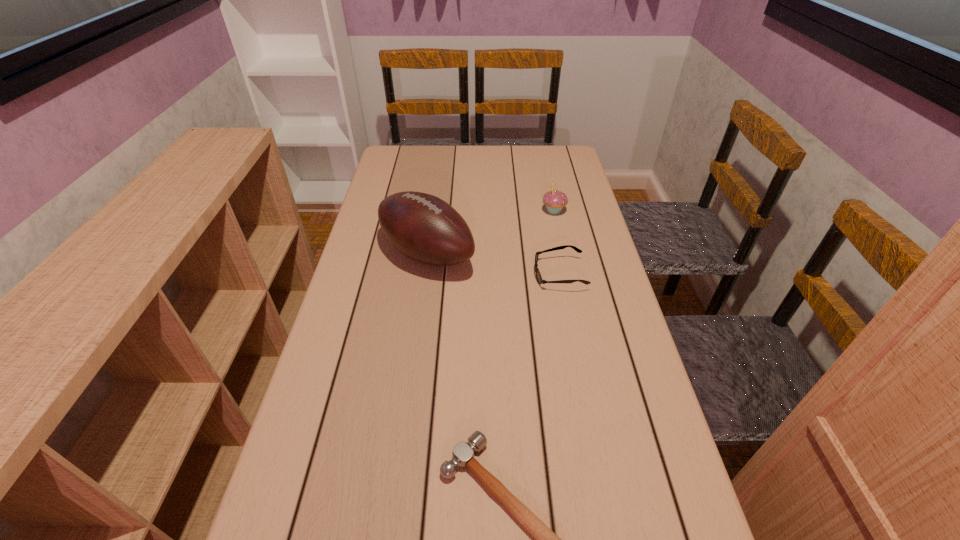
Identify the location of vacant region between the sunglasses and the football (American). (493, 264).

Identify the location of vacant space that is in between the third tallest object and the third shortest object. (557, 242).

Point out which object is positioned as the third nearest to the hammer. Please provide its 2D coordinates. Your answer should be formatted as a tuple, i.e. [(x, y)], where the tuple contains the x and y coordinates of a point satisfying the conditions above.

[(554, 200)]

Identify the location of object that is the closest to the sunglasses. (423, 227).

Find the location of a particular element. This screenshot has width=960, height=540. free space that satisfies the following two spatial constraints: 1. on the front side of the farthest object; 2. on the lenses of the second shortest object is located at coordinates (567, 274).

In order to click on free space in the image that satisfies the following two spatial constraints: 1. on the front side of the cupcake; 2. on the lenses of the sunglasses in this screenshot , I will do `click(567, 274)`.

Where is `free space that satisfies the following two spatial constraints: 1. on the front side of the third shortest object; 2. on the lenses of the third tallest object`? free space that satisfies the following two spatial constraints: 1. on the front side of the third shortest object; 2. on the lenses of the third tallest object is located at coordinates (567, 274).